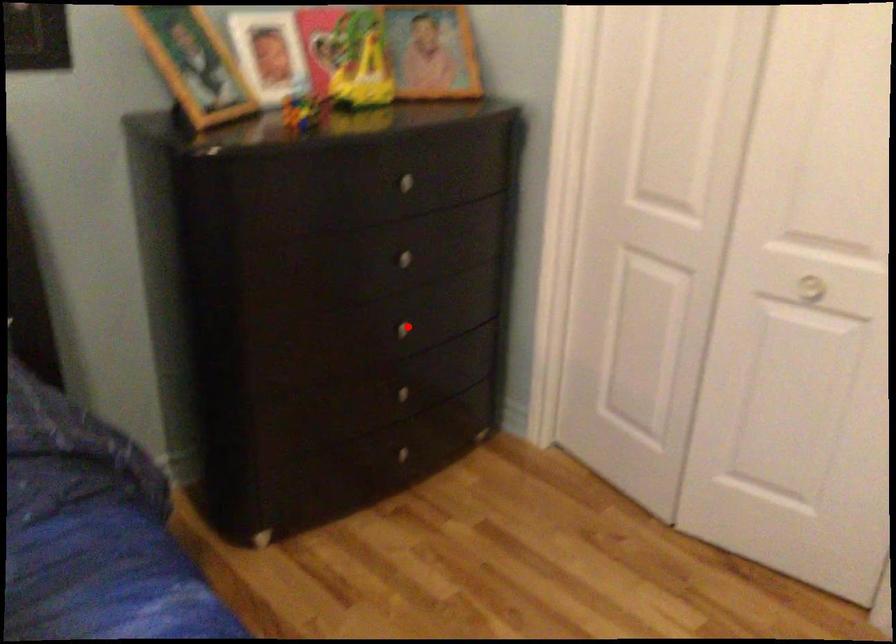
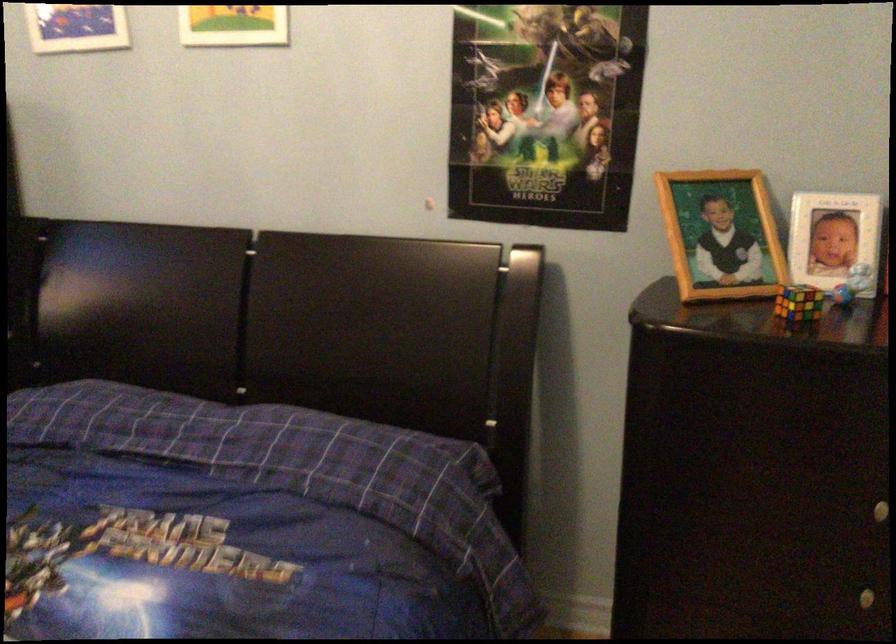
Locate, in the second image, the point that corresponds to the highlighted location in the first image.

(868, 597)